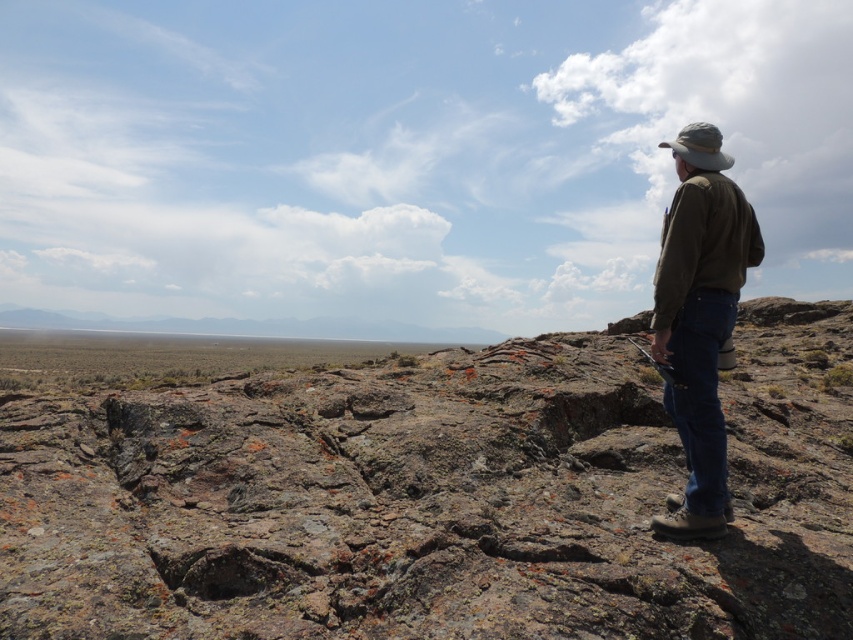
Question: Among these points, which one is farthest from the camera?

Choices:
 (A) (726, 317)
 (B) (697, 129)

Answer: (B)

Question: Among these objects, which one is nearest to the camera?

Choices:
 (A) rusty rock at center
 (B) khaki fabric hat at upper right

Answer: (A)

Question: Does olive-green fabric jacket at center-right have a smaller size compared to khaki fabric hat at upper right?

Choices:
 (A) no
 (B) yes

Answer: (B)

Question: Which point is closer to the camera?

Choices:
 (A) rusty rock at center
 (B) khaki fabric hat at upper right
 (C) olive-green fabric jacket at center-right

Answer: (A)

Question: Does rusty rock at center have a greater width compared to khaki fabric hat at upper right?

Choices:
 (A) yes
 (B) no

Answer: (A)

Question: Does olive-green fabric jacket at center-right appear over khaki fabric hat at upper right?

Choices:
 (A) yes
 (B) no

Answer: (B)